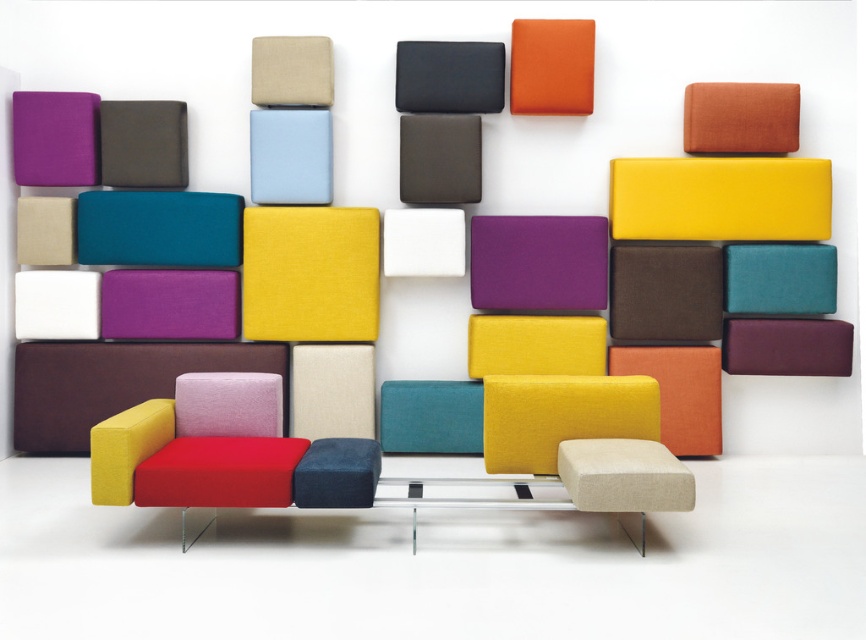
You are arranging a living room and want to place a new lamp between the matte gray cushion at upper left and the beige fabric cushion at upper center. Based on their positions, where should you place the lamp?

The lamp should be placed between the matte gray cushion at upper left and the beige fabric cushion at upper center, as the matte gray cushion at upper left is positioned to the left of the beige fabric cushion at upper center.

You are standing at the center of the image and want to move to the matte fabric armchair at lower left. Which direction should you move in to reach it?

The matte fabric armchair at lower left is located at point [198,445], so you should move towards the lower left direction to reach it.